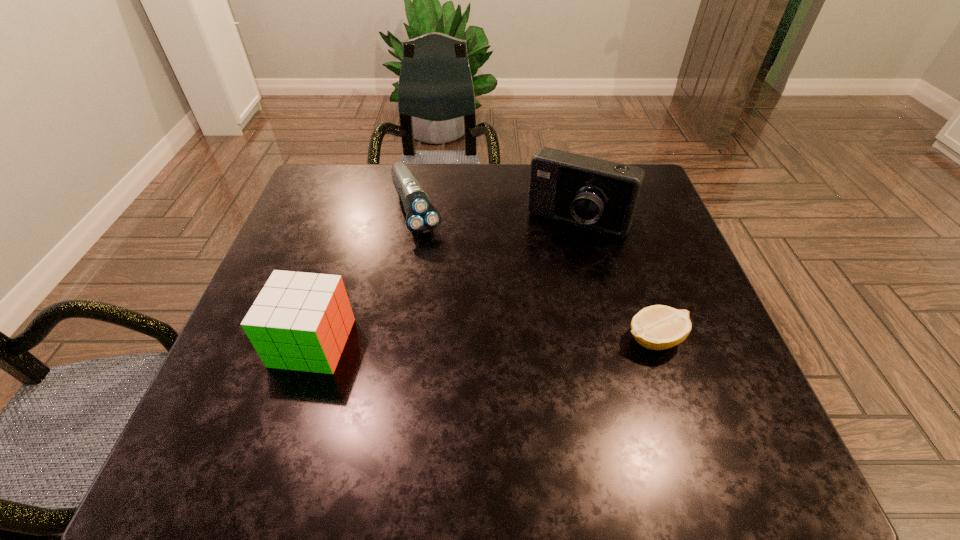
In order to click on vacant space located 0.240m on the head of the third tallest object in this screenshot , I will do `click(455, 309)`.

What are the coordinates of `vacant region located 0.370m on the front-facing side of the tallest object` in the screenshot? It's located at (489, 355).

You are a GUI agent. You are given a task and a screenshot of the screen. Output one action in this format:
    pyautogui.click(x=<x>, y=<y>)
    Task: Click on the free space located 0.380m on the front-facing side of the tallest object
    
    Given the screenshot: What is the action you would take?
    pyautogui.click(x=486, y=359)

Identify the location of free space located 0.290m on the front-facing side of the tallest object. (506, 326).

The image size is (960, 540). Find the location of `electric shaver that is positioned at the far edge`. electric shaver that is positioned at the far edge is located at coordinates (422, 217).

The image size is (960, 540). Identify the location of camera located in the far edge section of the desktop. (595, 194).

Find the location of a particular element. object that is at the near edge is located at coordinates (300, 321).

What are the coordinates of `object that is at the left edge` in the screenshot? It's located at (300, 321).

Locate an element on the screen. lemon that is positioned at the right edge is located at coordinates (658, 327).

Identify the location of camera at the right edge. The width and height of the screenshot is (960, 540). (595, 194).